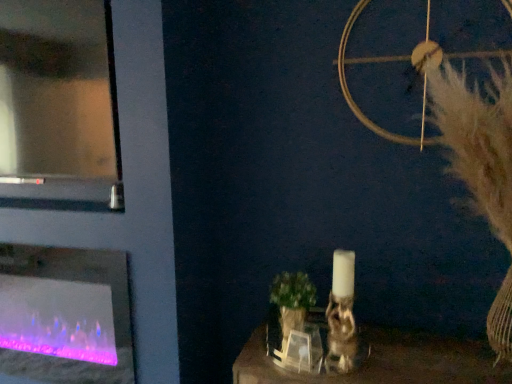
Question: Considering the relative positions of translucent glass fireplace at left and transparent glass door at upper left in the image provided, is translucent glass fireplace at left to the left of transparent glass door at upper left from the viewer's perspective?

Choices:
 (A) yes
 (B) no

Answer: (B)

Question: From a real-world perspective, is translucent glass fireplace at left located higher than transparent glass door at upper left?

Choices:
 (A) no
 (B) yes

Answer: (A)

Question: From a real-world perspective, is translucent glass fireplace at left located beneath transparent glass door at upper left?

Choices:
 (A) yes
 (B) no

Answer: (A)

Question: Is translucent glass fireplace at left positioned before transparent glass door at upper left?

Choices:
 (A) yes
 (B) no

Answer: (B)

Question: Is translucent glass fireplace at left touching transparent glass door at upper left?

Choices:
 (A) yes
 (B) no

Answer: (B)

Question: From their relative heights in the image, would you say transparent glass door at upper left is taller or shorter than white fluffy feather at upper right?

Choices:
 (A) tall
 (B) short

Answer: (B)

Question: Would you say transparent glass door at upper left is inside or outside white fluffy feather at upper right?

Choices:
 (A) outside
 (B) inside

Answer: (A)

Question: Is transparent glass door at upper left to the left or to the right of white fluffy feather at upper right in the image?

Choices:
 (A) right
 (B) left

Answer: (B)

Question: In terms of width, does transparent glass door at upper left look wider or thinner when compared to white fluffy feather at upper right?

Choices:
 (A) thin
 (B) wide

Answer: (A)

Question: Considering the relative positions of white fluffy feather at upper right and translucent glass fireplace at left in the image provided, is white fluffy feather at upper right to the left or to the right of translucent glass fireplace at left?

Choices:
 (A) right
 (B) left

Answer: (A)

Question: Considering the positions of white fluffy feather at upper right and translucent glass fireplace at left in the image, is white fluffy feather at upper right taller or shorter than translucent glass fireplace at left?

Choices:
 (A) short
 (B) tall

Answer: (B)

Question: Is white fluffy feather at upper right inside the boundaries of translucent glass fireplace at left, or outside?

Choices:
 (A) outside
 (B) inside

Answer: (A)

Question: In the image, is white fluffy feather at upper right positioned in front of or behind translucent glass fireplace at left?

Choices:
 (A) front
 (B) behind

Answer: (A)

Question: Considering their positions, is translucent glass fireplace at left located in front of or behind white fluffy feather at upper right?

Choices:
 (A) front
 (B) behind

Answer: (B)

Question: Considering the positions of point (8, 380) and point (505, 114), is point (8, 380) closer or farther from the camera than point (505, 114)?

Choices:
 (A) closer
 (B) farther

Answer: (B)